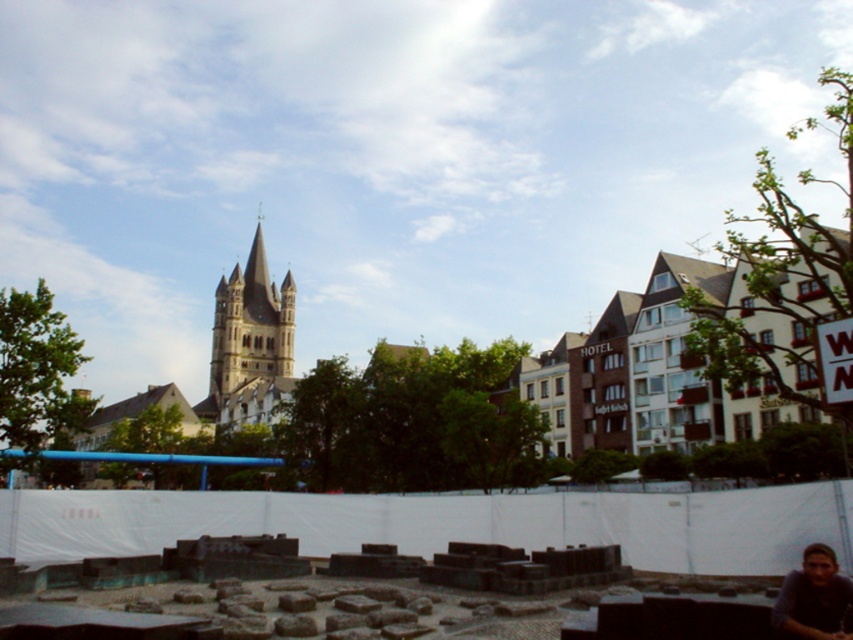
Question: Does golden stone tower at center have a smaller size compared to blurred skin face at lower right?

Choices:
 (A) no
 (B) yes

Answer: (A)

Question: Is golden stone tower at center above blurred skin face at lower right?

Choices:
 (A) yes
 (B) no

Answer: (A)

Question: Among these objects, which one is nearest to the camera?

Choices:
 (A) golden stone tower at center
 (B) blurred skin face at lower right

Answer: (B)

Question: Is golden stone tower at center bigger than blurred skin face at lower right?

Choices:
 (A) no
 (B) yes

Answer: (B)

Question: Which point appears farthest from the camera in this image?

Choices:
 (A) (846, 616)
 (B) (233, 280)

Answer: (B)